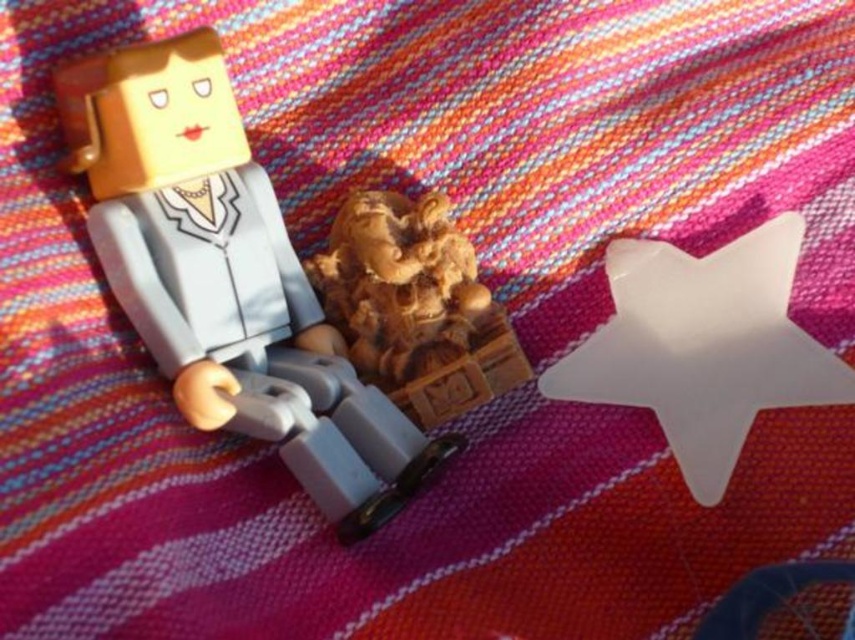
You are looking at the image and want to determine which of the two points, point (783, 317) or point (422, 195), is closer to you. Based on the scene, which point is nearer?

Point (783, 317) is closer to the camera than point (422, 195).